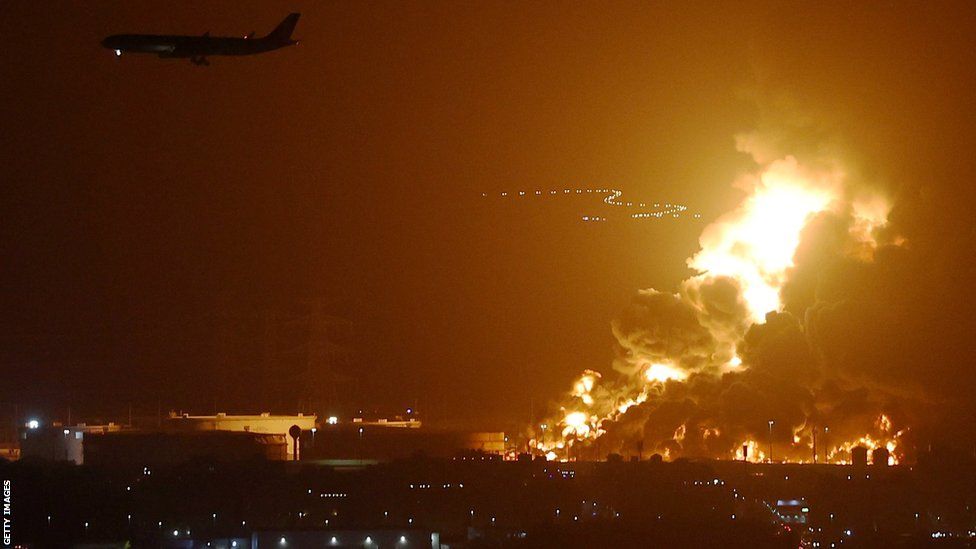
This screenshot has width=976, height=549. I want to click on lights, so click(x=491, y=199), click(x=557, y=184), click(x=606, y=191), click(x=662, y=209), click(x=622, y=220), click(x=596, y=223).